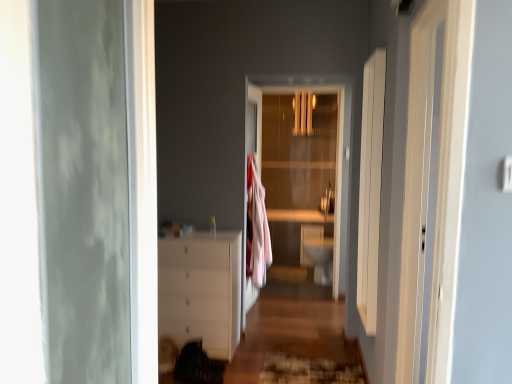
I want to click on free space above white glossy dresser at lower left (from a real-world perspective), so click(289, 309).